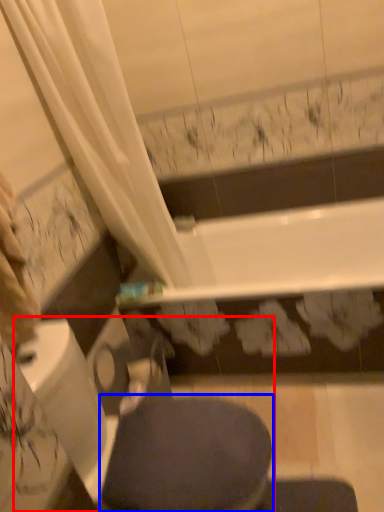
Question: Which object is closer to the camera taking this photo, swivel chair (highlighted by a red box) or bidet (highlighted by a blue box)?

Choices:
 (A) swivel chair
 (B) bidet

Answer: (A)